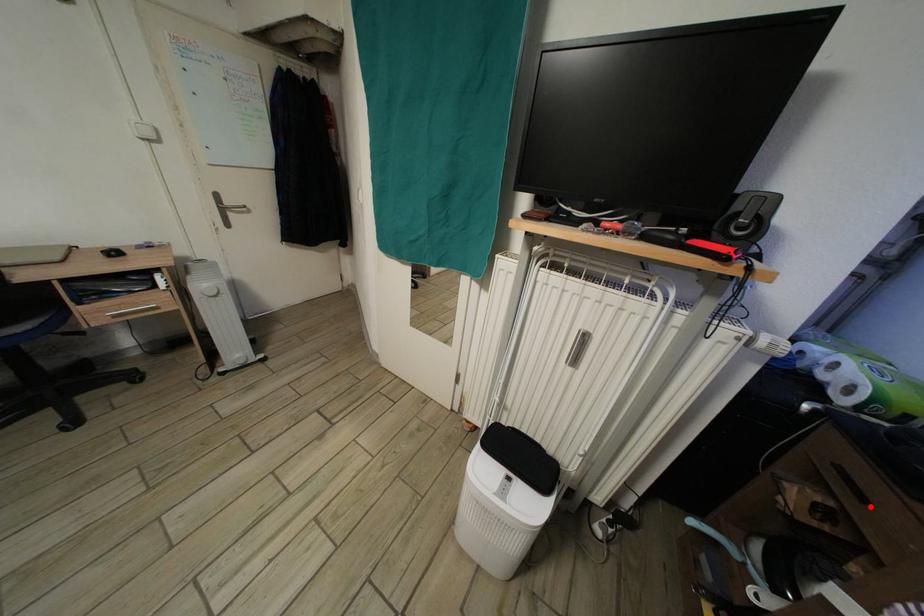
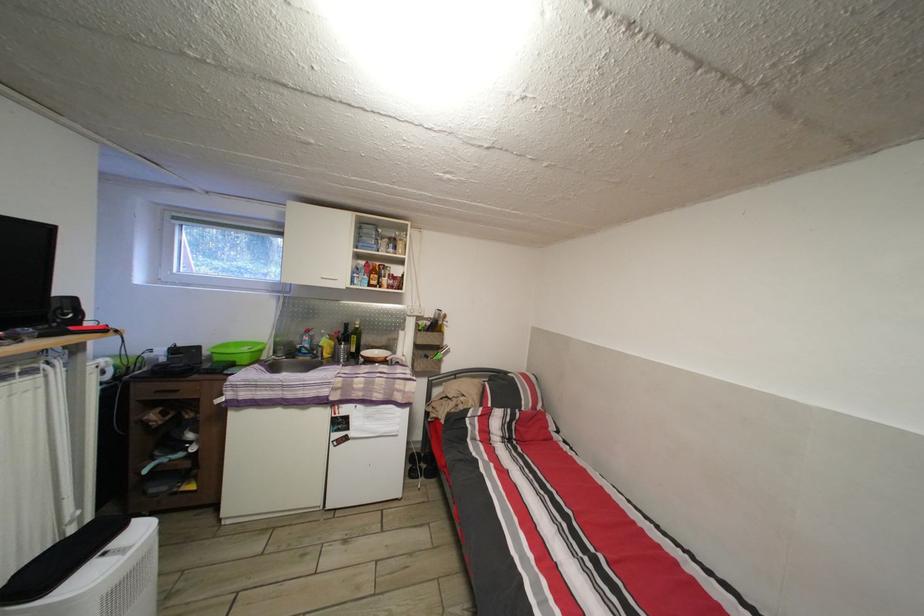
Question: I am providing you with two images of the same scene from different viewpoints. Given a red point in image1, look at the same physical point in image2. Is it:

Choices:
 (A) Closer to the viewpoint
 (B) Farther from the viewpoint

Answer: (A)